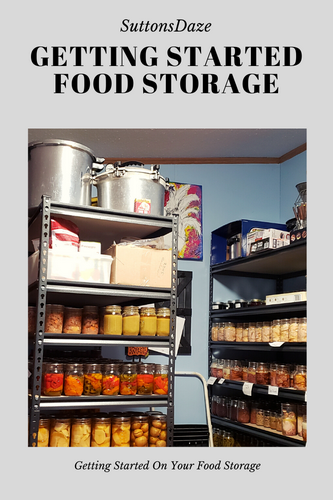
The width and height of the screenshot is (333, 500). I want to click on shelf post, so click(x=40, y=290), click(x=175, y=306), click(x=212, y=296), click(x=280, y=286).